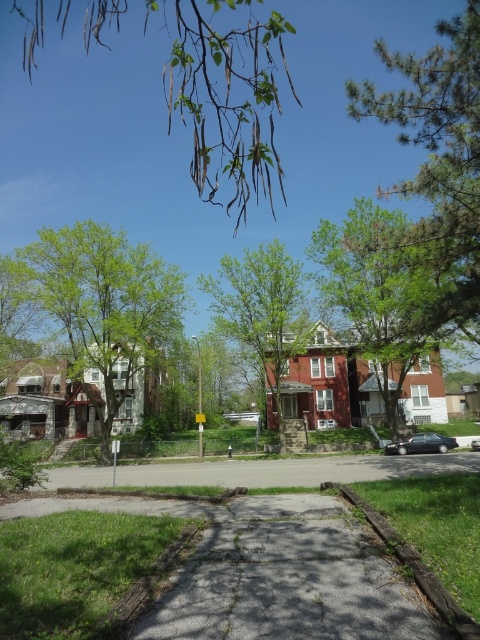
You are a delivery person with a cart that can travel up to 60 feet. You need to deliver a package from the gray concrete pavement at center to the green leafy tree at upper center. Can your cart make the trip without needing a recharge?

The distance between the gray concrete pavement at center and the green leafy tree at upper center is 61.86 feet. Since your cart can only travel up to 60 feet before needing a recharge, you will not be able to make the trip without recharging.

From the picture: You are standing at the point marked by the coordinates point (288, 579) in the scene. What object are you standing on?

You are standing on the gray concrete pavement at center, which is represented by the coordinates point (288, 579).